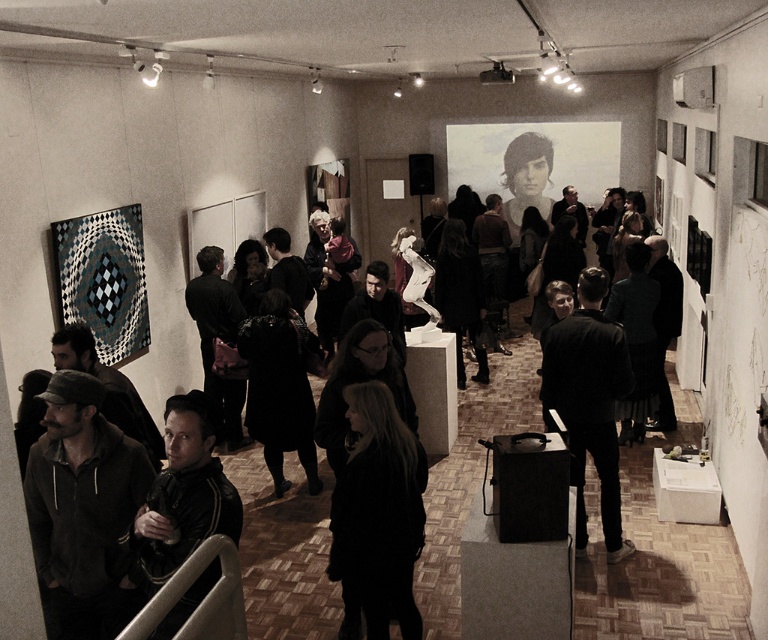
You are an event organizer who needs to place a new display stand between the dark wool coat at center and the black leather jacket at lower left. Based on their sizes, which object should the stand be closer to?

The dark wool coat at center occupies less space than the black leather jacket at lower left, so the stand should be placed closer to the black leather jacket at lower left to account for its larger size.

You are an art critic standing at the entrance of the gallery. You notice two points marked in the image. Which point is closer to you, point (74, 525) or point (384, 452)?

Point (74, 525) is in front of point (384, 452), so it is closer to you.